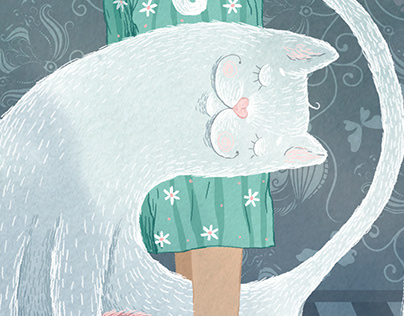
Find the location of a particular element. striped floor is located at coordinates point(344,308), point(374,304).